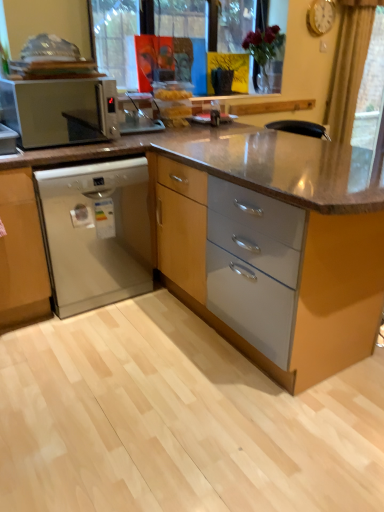
Question: From the image's perspective, is matte wood cabinet at center on top of satin silver dishwasher at lower left?

Choices:
 (A) no
 (B) yes

Answer: (A)

Question: Is matte wood cabinet at center oriented away from satin silver dishwasher at lower left?

Choices:
 (A) yes
 (B) no

Answer: (B)

Question: Can you confirm if matte wood cabinet at center is bigger than satin silver dishwasher at lower left?

Choices:
 (A) yes
 (B) no

Answer: (A)

Question: Is matte wood cabinet at center directly adjacent to satin silver dishwasher at lower left?

Choices:
 (A) no
 (B) yes

Answer: (A)

Question: Can you confirm if matte wood cabinet at center is wider than satin silver dishwasher at lower left?

Choices:
 (A) yes
 (B) no

Answer: (A)

Question: From the image's perspective, is satin silver dishwasher at lower left located above or below white plastic microwave at left?

Choices:
 (A) below
 (B) above

Answer: (A)

Question: In terms of height, does satin silver dishwasher at lower left look taller or shorter compared to white plastic microwave at left?

Choices:
 (A) short
 (B) tall

Answer: (B)

Question: Considering their positions, is satin silver dishwasher at lower left located in front of or behind white plastic microwave at left?

Choices:
 (A) behind
 (B) front

Answer: (A)

Question: Do you think satin silver dishwasher at lower left is within white plastic microwave at left, or outside of it?

Choices:
 (A) outside
 (B) inside

Answer: (A)

Question: From a real-world perspective, relative to matte wood cabinet at center, is beige fabric curtain at upper right vertically above or below?

Choices:
 (A) above
 (B) below

Answer: (A)

Question: Does point (340, 58) appear closer or farther from the camera than point (150, 169)?

Choices:
 (A) farther
 (B) closer

Answer: (A)

Question: Would you say beige fabric curtain at upper right is to the left or to the right of matte wood cabinet at center in the picture?

Choices:
 (A) left
 (B) right

Answer: (B)

Question: From the image's perspective, is beige fabric curtain at upper right positioned above or below matte wood cabinet at center?

Choices:
 (A) below
 (B) above

Answer: (B)

Question: In the image, is white plastic microwave at left positioned in front of or behind matte wood cabinet at center?

Choices:
 (A) behind
 (B) front

Answer: (A)

Question: From a real-world perspective, relative to matte wood cabinet at center, is white plastic microwave at left vertically above or below?

Choices:
 (A) above
 (B) below

Answer: (A)